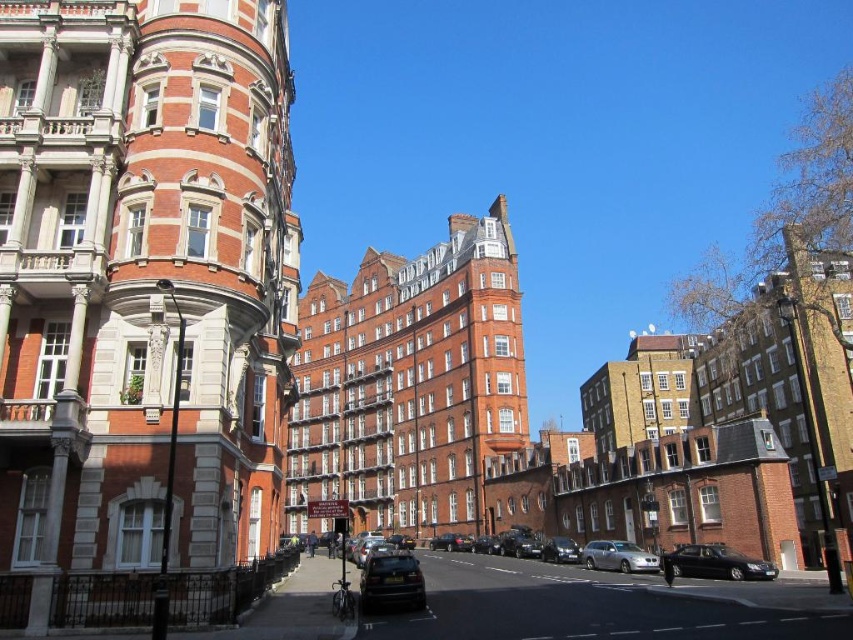
Question: Which object is farther from the camera taking this photo?

Choices:
 (A) shiny black sedan at lower right
 (B) shiny silver car at center
 (C) shiny black car at lower center

Answer: (B)

Question: Is shiny black car at lower center thinner than shiny silver car at center?

Choices:
 (A) yes
 (B) no

Answer: (B)

Question: Which point is closer to the camera?

Choices:
 (A) (567, 538)
 (B) (403, 564)
 (C) (776, 570)
 (D) (631, 560)

Answer: (B)

Question: Where is shiny black sedan at lower right located in relation to shiny silver car at center in the image?

Choices:
 (A) right
 (B) left

Answer: (A)

Question: Among these objects, which one is nearest to the camera?

Choices:
 (A) shiny silver car at center
 (B) shiny black sedan at lower right
 (C) shiny black car at lower center

Answer: (C)

Question: Is shiny black car at lower center bigger than shiny silver car at center?

Choices:
 (A) yes
 (B) no

Answer: (A)